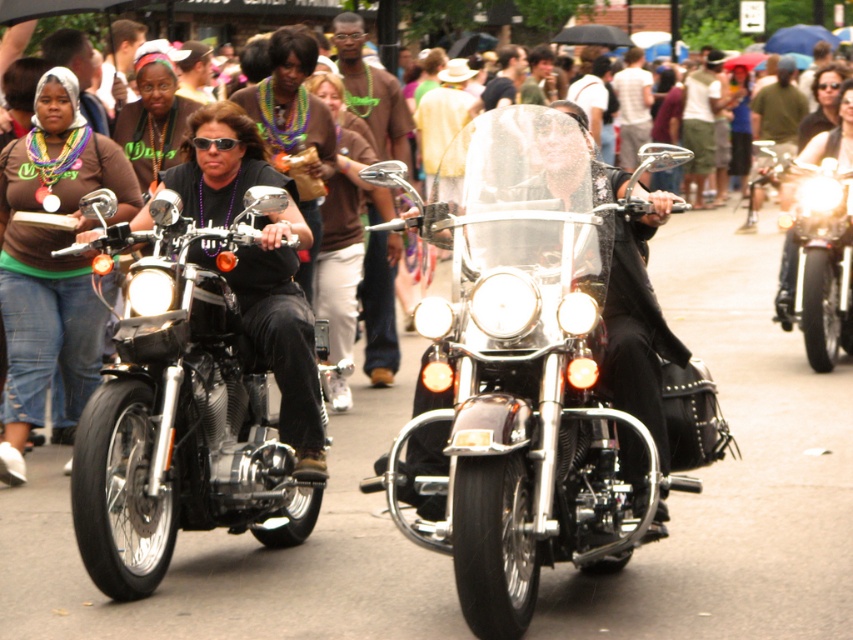
Can you confirm if shiny chrome motorcycle at left is positioned to the right of shiny black leather jacket at center?

In fact, shiny chrome motorcycle at left is to the left of shiny black leather jacket at center.

Who is taller, shiny chrome motorcycle at left or shiny black leather jacket at center?

Standing taller between the two is shiny chrome motorcycle at left.

Which is in front, point (221, 320) or point (358, 108)?

Point (221, 320)

The image size is (853, 640). What are the coordinates of `shiny chrome motorcycle at left` in the screenshot? It's located at (183, 412).

Can you confirm if shiny black leather jacket at center is positioned to the right of sunglasses at center?

Indeed, shiny black leather jacket at center is positioned on the right side of sunglasses at center.

Which is in front, point (370, 323) or point (224, 140)?

Point (224, 140) is in front.

Where is `shiny black leather jacket at center`? Image resolution: width=853 pixels, height=640 pixels. shiny black leather jacket at center is located at coordinates (370, 90).

Can you confirm if shiny chrome motorcycle at left is positioned above sunglasses at center?

No.

Can you confirm if shiny chrome motorcycle at left is wider than sunglasses at center?

Yes, shiny chrome motorcycle at left is wider than sunglasses at center.

What do you see at coordinates (183, 412) in the screenshot? The width and height of the screenshot is (853, 640). I see `shiny chrome motorcycle at left` at bounding box center [183, 412].

The height and width of the screenshot is (640, 853). Identify the location of shiny chrome motorcycle at left. (183, 412).